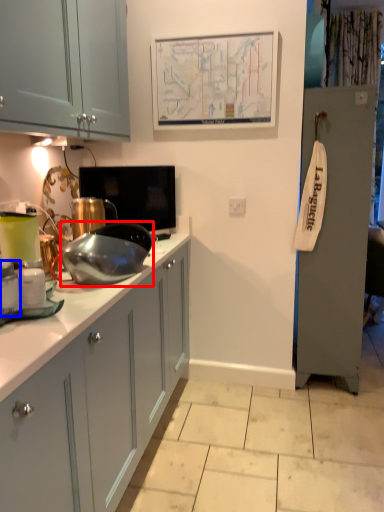
Question: Among these objects, which one is nearest to the camera, appliance (highlighted by a red box) or kitchen appliance (highlighted by a blue box)?

Choices:
 (A) appliance
 (B) kitchen appliance

Answer: (B)